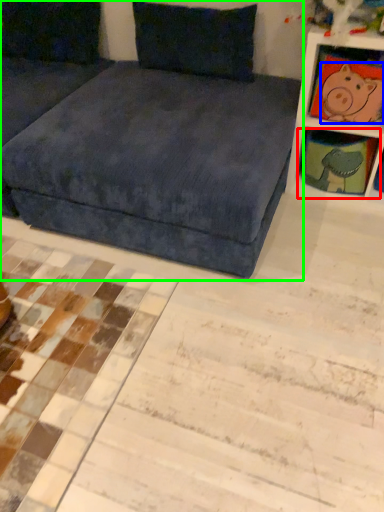
Question: Which object is the farthest from shelf (highlighted by a red box)? Choose among these: animal (highlighted by a blue box) or studio couch (highlighted by a green box).

Choices:
 (A) animal
 (B) studio couch

Answer: (B)